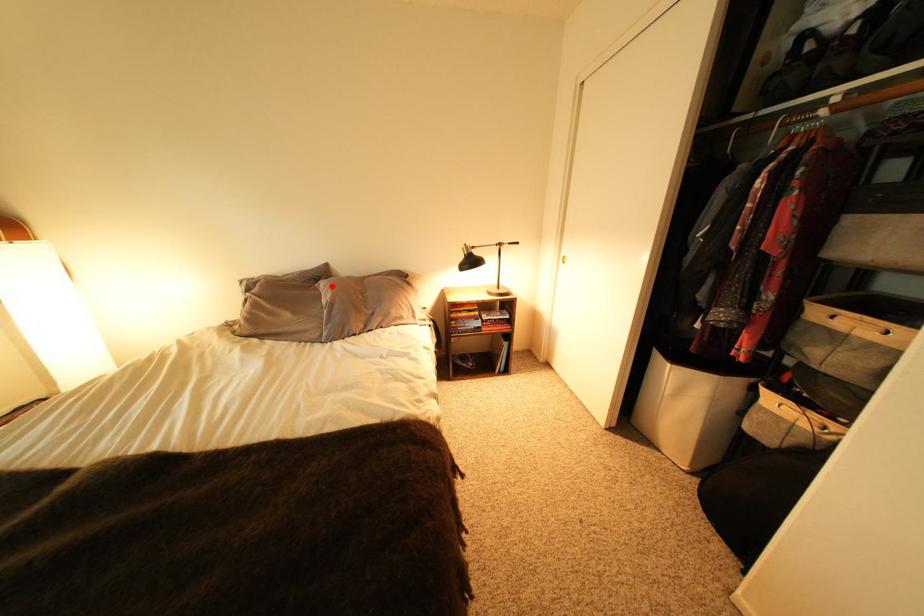
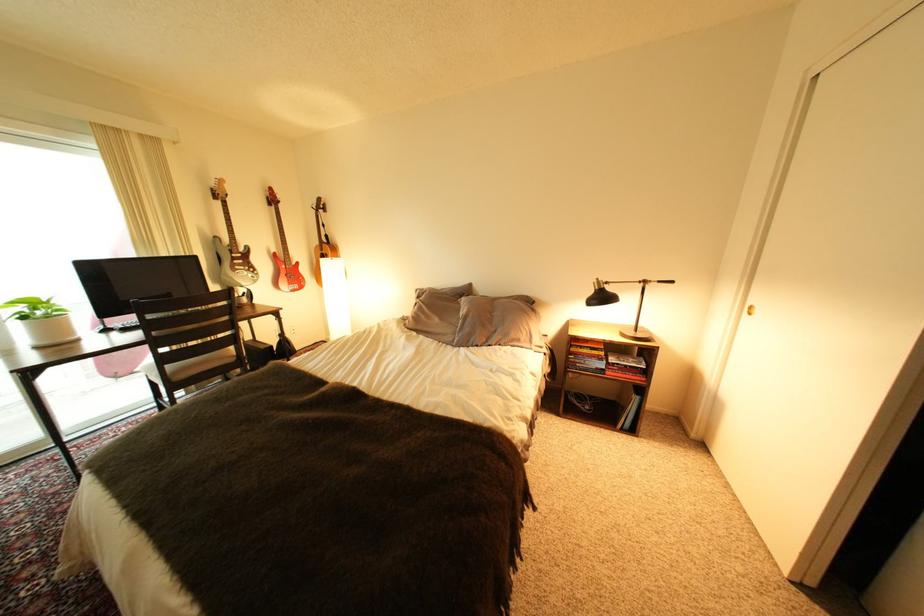
In the second image, find the point that corresponds to the highlighted location in the first image.

(473, 302)